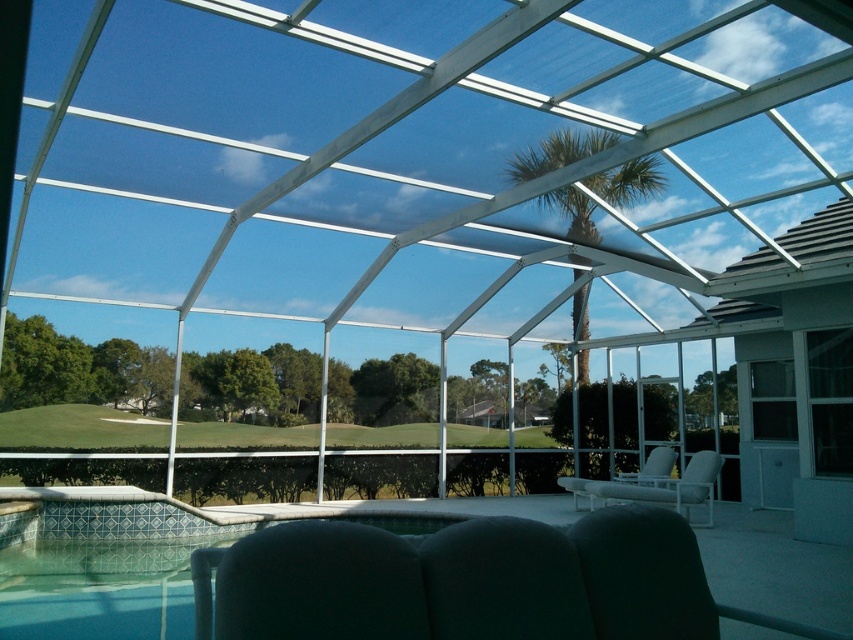
Question: Does black leather chair at lower center come behind white fabric chair at center?

Choices:
 (A) no
 (B) yes

Answer: (A)

Question: Which object appears closest to the camera in this image?

Choices:
 (A) white fabric chair at center
 (B) white plastic chair at lower right
 (C) dark fabric chair at lower center
 (D) white plastic chair at center

Answer: (C)

Question: Does black leather chair at lower center have a greater width compared to dark gray fabric chair at lower center?

Choices:
 (A) yes
 (B) no

Answer: (A)

Question: Considering the real-world distances, which object is closest to the green leafy palm tree at upper center?

Choices:
 (A) black leather chair at lower center
 (B) white fabric chair at center

Answer: (B)

Question: Which object appears farthest from the camera in this image?

Choices:
 (A) white fabric chair at center
 (B) dark gray fabric chair at lower center

Answer: (A)

Question: Is green leafy palm tree at upper center bigger than white plastic chair at lower right?

Choices:
 (A) yes
 (B) no

Answer: (B)